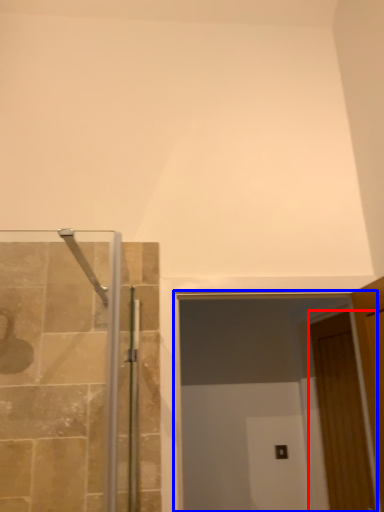
Question: Among these objects, which one is nearest to the camera, door (highlighted by a red box) or glass door (highlighted by a blue box)?

Choices:
 (A) door
 (B) glass door

Answer: (B)